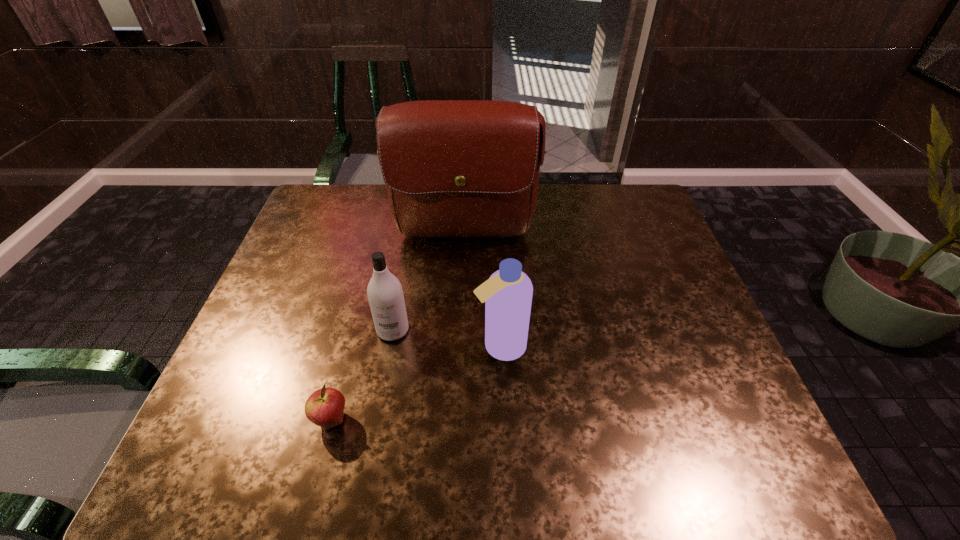
Where is `the farthest object`? This screenshot has height=540, width=960. the farthest object is located at coordinates (453, 168).

The image size is (960, 540). In order to click on satchel in this screenshot , I will do (453, 168).

I want to click on the right shampoo, so click(x=507, y=294).

Where is `the left shampoo`? The image size is (960, 540). the left shampoo is located at coordinates (385, 294).

Locate an element on the screen. The height and width of the screenshot is (540, 960). the shortest object is located at coordinates coord(325,407).

This screenshot has height=540, width=960. I want to click on apple, so coord(325,407).

You are a GUI agent. You are given a task and a screenshot of the screen. Output one action in this format:
    pyautogui.click(x=<x>, y=<y>)
    Task: Click on the vacant space located on the open flap of the satchel
    
    Given the screenshot: What is the action you would take?
    pyautogui.click(x=460, y=332)

At what (x,y) coordinates should I click in order to perform the action: click on vacant space positioned 0.070m on the right of the right shampoo. Please return your answer as a coordinate pair (x, y). Looking at the image, I should click on (557, 346).

Image resolution: width=960 pixels, height=540 pixels. Find the location of `vacant space located 0.070m on the front-facing side of the left shampoo`. vacant space located 0.070m on the front-facing side of the left shampoo is located at coordinates (386, 368).

The height and width of the screenshot is (540, 960). I want to click on vacant space located on the left of the leftmost object, so click(274, 420).